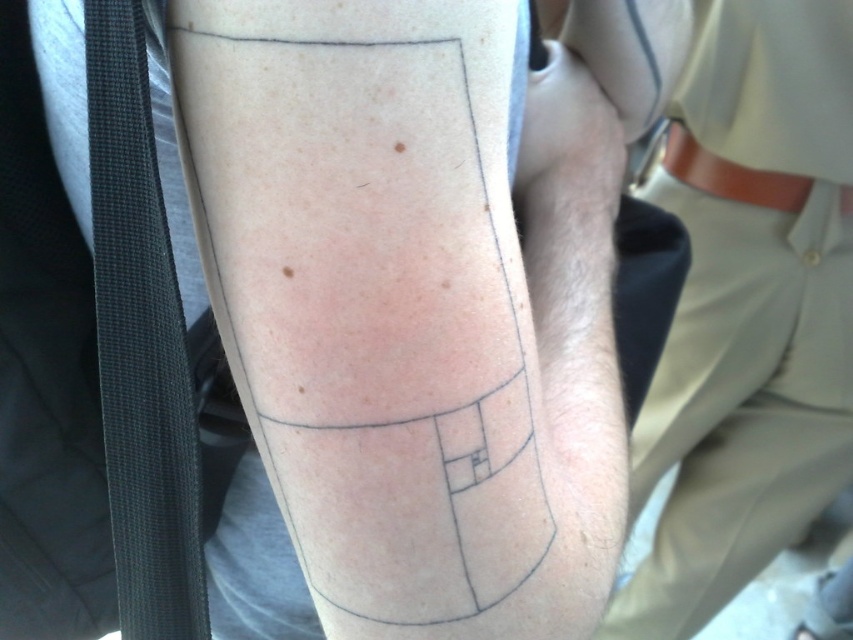
Question: Which point appears farthest from the camera in this image?

Choices:
 (A) (795, 509)
 (B) (375, 544)

Answer: (A)

Question: Is black ink tattoo at center in front of beige fabric pants at lower right?

Choices:
 (A) no
 (B) yes

Answer: (B)

Question: Which object is closer to the camera taking this photo?

Choices:
 (A) beige fabric pants at lower right
 (B) black ink tattoo at center

Answer: (B)

Question: Is black ink tattoo at center positioned in front of beige fabric pants at lower right?

Choices:
 (A) yes
 (B) no

Answer: (A)

Question: Does black ink tattoo at center have a smaller size compared to beige fabric pants at lower right?

Choices:
 (A) no
 (B) yes

Answer: (B)